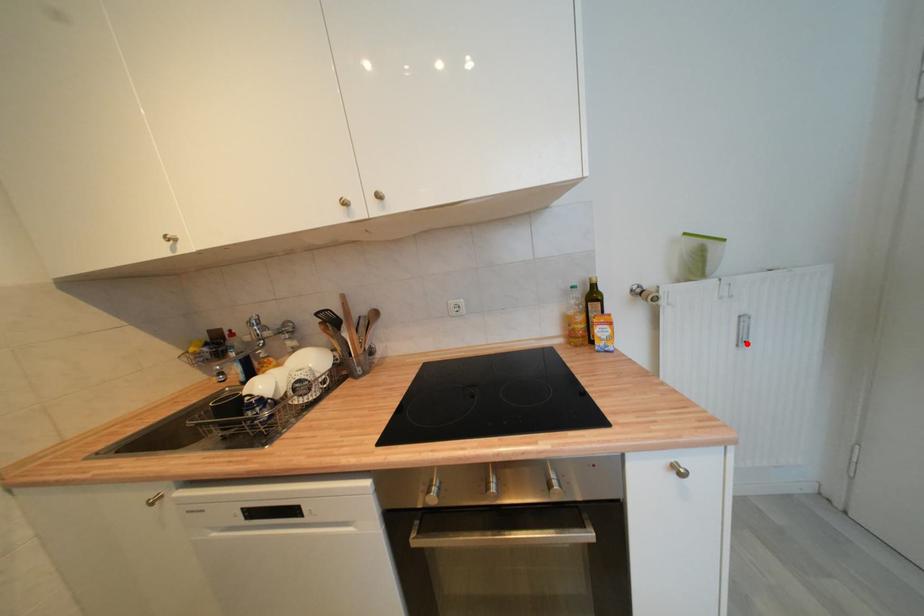
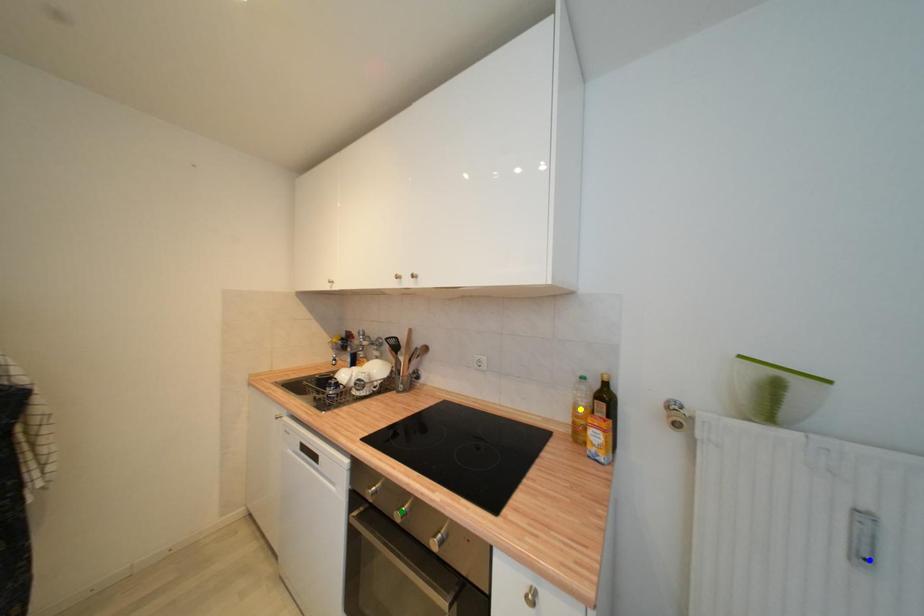
Question: I am providing you with two images of the same scene from different viewpoints. A red point is marked on the first image. You are given multiple points on the second image. Which spot in image 2 lines up with the point in image 1?

Choices:
 (A) blue point
 (B) green point
 (C) yellow point

Answer: (A)